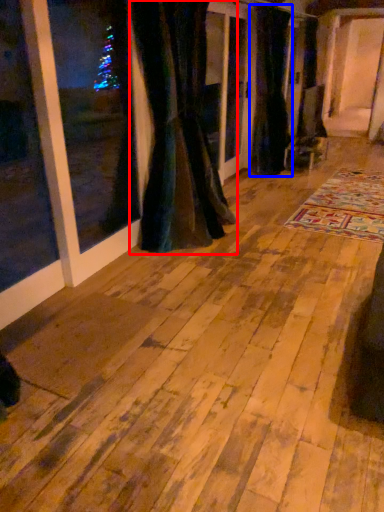
Question: Which object is further to the camera taking this photo, curtain (highlighted by a red box) or curtain (highlighted by a blue box)?

Choices:
 (A) curtain
 (B) curtain

Answer: (B)